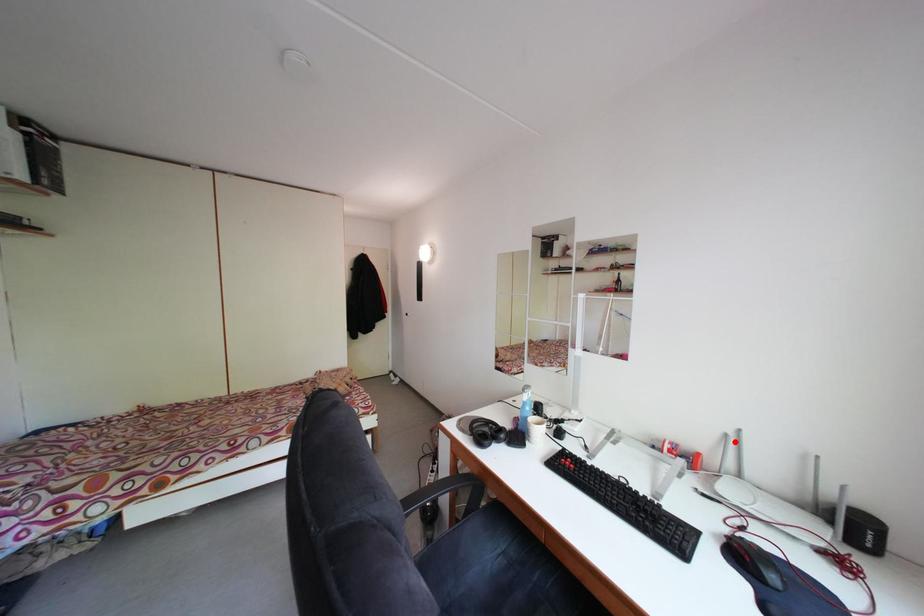
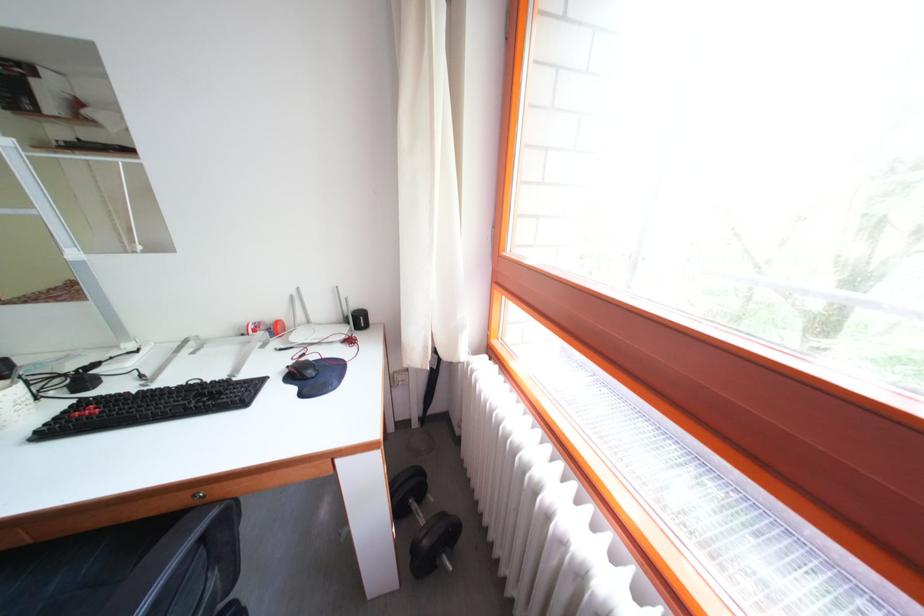
In the second image, find the point that corresponds to the highlighted location in the first image.

(300, 302)